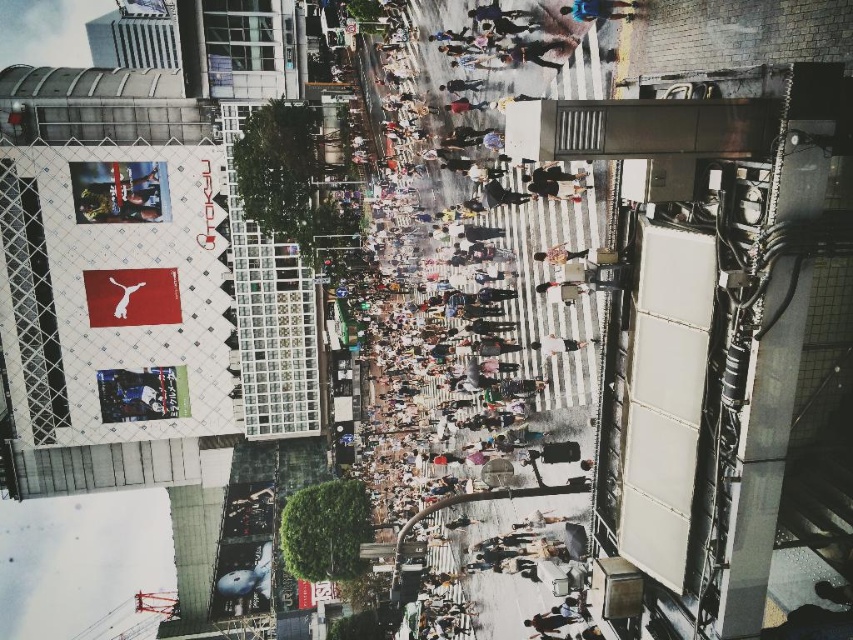
Is light brown leather bag at center below light brown leather jacket at center?

Correct, light brown leather bag at center is located below light brown leather jacket at center.

Is light brown leather bag at center above light brown leather jacket at center?

Incorrect, light brown leather bag at center is not positioned above light brown leather jacket at center.

Where is `light brown leather bag at center`? The height and width of the screenshot is (640, 853). light brown leather bag at center is located at coordinates (556, 344).

Where is `light brown leather bag at center`? light brown leather bag at center is located at coordinates (556, 344).

From the picture: Is human crowd at center shorter than light brown leather bag at center?

No, human crowd at center is not shorter than light brown leather bag at center.

Does human crowd at center have a smaller size compared to light brown leather bag at center?

No.

Between point (538, 221) and point (554, 348), which one is positioned behind?

The point (538, 221) is behind.

Find the location of a particular element. The width and height of the screenshot is (853, 640). human crowd at center is located at coordinates (479, 339).

Does human crowd at center have a lesser width compared to light brown leather jacket at center?

Incorrect, human crowd at center's width is not less than light brown leather jacket at center's.

Is human crowd at center positioned at the back of light brown leather jacket at center?

No.

Describe the element at coordinates (479, 339) in the screenshot. I see `human crowd at center` at that location.

Image resolution: width=853 pixels, height=640 pixels. I want to click on human crowd at center, so click(x=479, y=339).